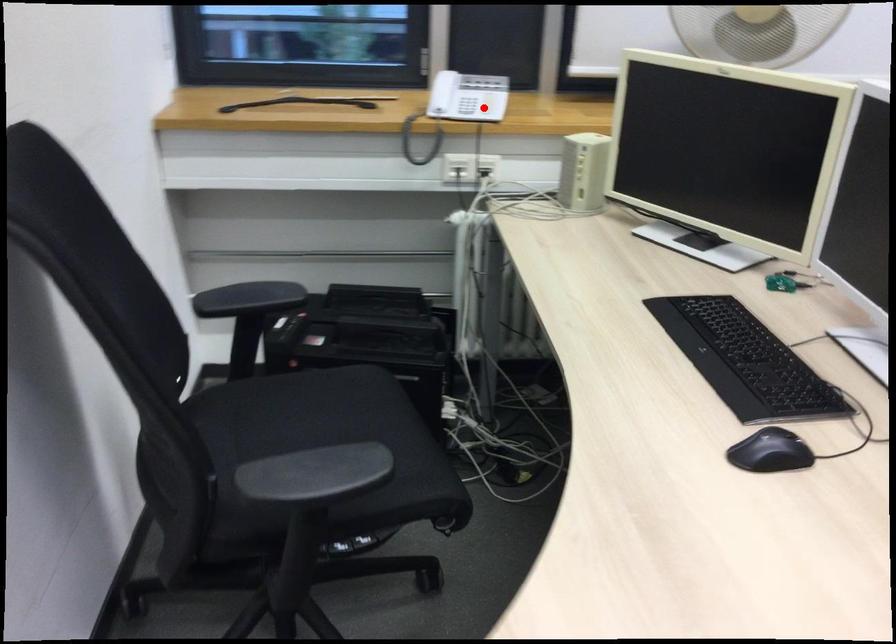
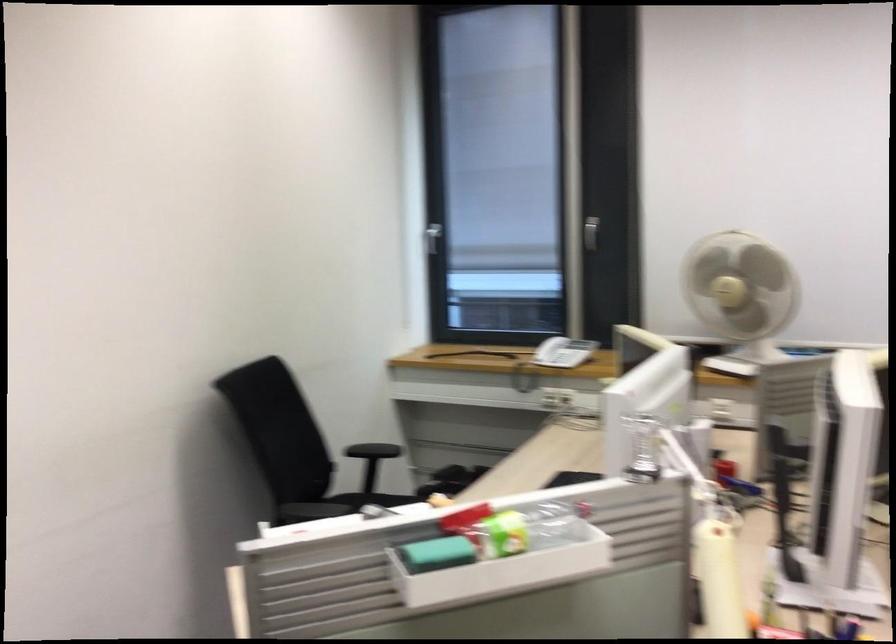
Where in the second image is the point corresponding to the highlighted location from the first image?

(563, 352)